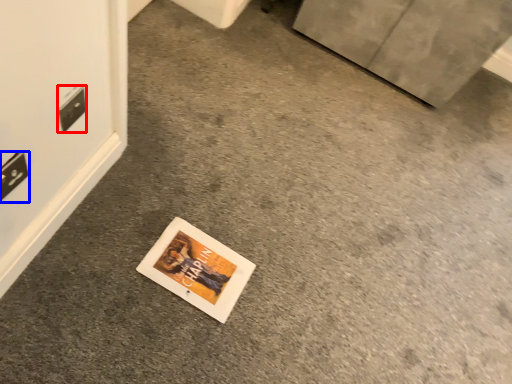
Question: Which point is further to the camera, electric outlet (highlighted by a red box) or electric outlet (highlighted by a blue box)?

Choices:
 (A) electric outlet
 (B) electric outlet

Answer: (A)